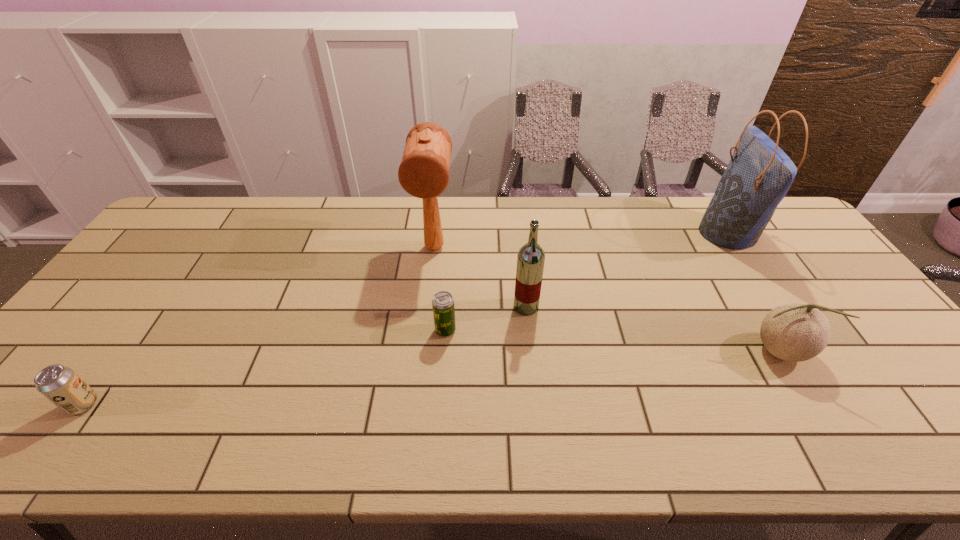
This screenshot has width=960, height=540. I want to click on free point located on the right of the liquor, so click(638, 307).

Locate an element on the screen. The width and height of the screenshot is (960, 540). blank area located on the back of the fourth tallest object is located at coordinates click(718, 249).

Identify the location of vacant space located 0.250m on the back of the right beer can. (450, 260).

You are a GUI agent. You are given a task and a screenshot of the screen. Output one action in this format:
    pyautogui.click(x=<x>, y=<y>)
    Task: Click on the blank space located on the back of the nearest object
    This screenshot has height=540, width=960.
    Given the screenshot: What is the action you would take?
    pyautogui.click(x=122, y=350)

The width and height of the screenshot is (960, 540). I want to click on shopping bag located at the far edge, so click(759, 174).

Locate an element on the screen. mallet that is at the far edge is located at coordinates (424, 170).

Where is `object at the left edge`? This screenshot has width=960, height=540. object at the left edge is located at coordinates (59, 384).

Identify the location of object at the right edge. (759, 174).

Locate an element on the screen. Image resolution: width=960 pixels, height=540 pixels. object that is at the far right corner is located at coordinates (759, 174).

In the image, there is a desktop. At what (x,y) coordinates should I click in order to perform the action: click on vacant region at the far edge. Please return your answer as a coordinate pair (x, y). Looking at the image, I should click on (355, 200).